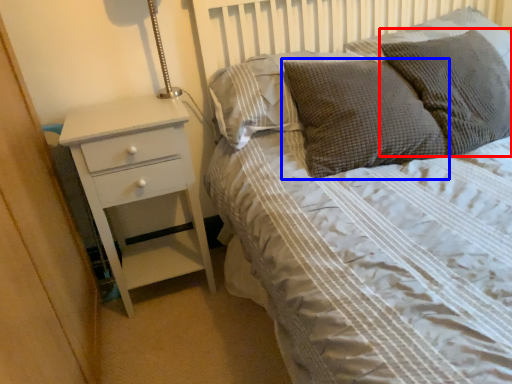
Question: Among these objects, which one is farthest to the camera, pillow (highlighted by a red box) or pillow (highlighted by a blue box)?

Choices:
 (A) pillow
 (B) pillow

Answer: (B)